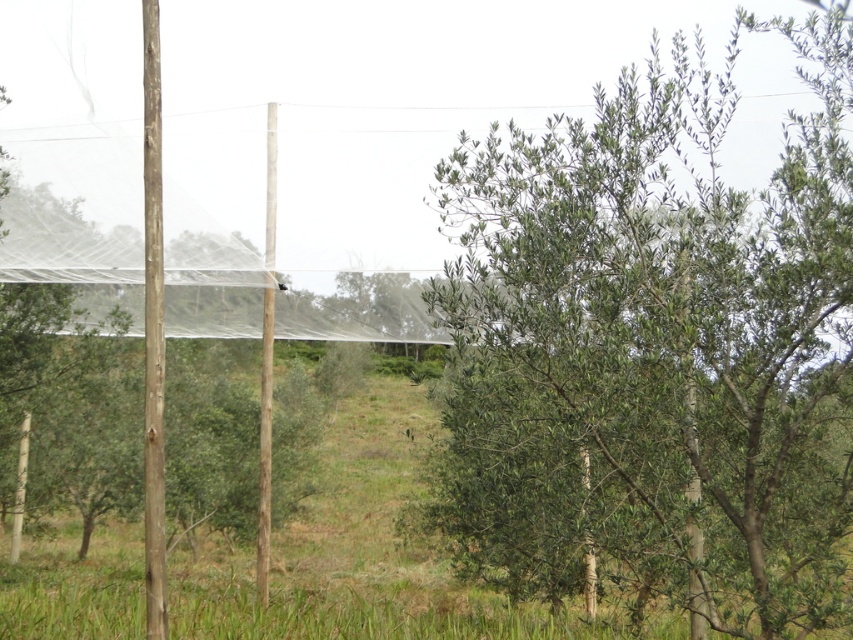
Does brown rough wooden pole at left have a larger size compared to brown wood pole at center?

Incorrect, brown rough wooden pole at left is not larger than brown wood pole at center.

Who is shorter, brown rough wooden pole at left or brown wood pole at center?

brown rough wooden pole at left is shorter.

You are a GUI agent. You are given a task and a screenshot of the screen. Output one action in this format:
    pyautogui.click(x=<x>, y=<y>)
    Task: Click on the brown rough wooden pole at left
    The width and height of the screenshot is (853, 640).
    Given the screenshot: What is the action you would take?
    pyautogui.click(x=154, y=330)

How much distance is there between green leafy tree at center and brown rough wooden pole at left?

The distance of green leafy tree at center from brown rough wooden pole at left is 15.70 feet.

Between green leafy tree at center and brown rough wooden pole at left, which one is positioned lower?

green leafy tree at center

Is point (653, 276) behind point (158, 561)?

That is True.

Where is `green leafy tree at center`? The image size is (853, 640). green leafy tree at center is located at coordinates (659, 344).

Between green leafy tree at center and brown wood pole at center, which one is positioned higher?

green leafy tree at center is above.

Does green leafy tree at center lie behind brown wood pole at center?

No, it is not.

Does point (685, 442) come in front of point (260, 440)?

Yes.

In order to click on green leafy tree at center in this screenshot , I will do [x=659, y=344].